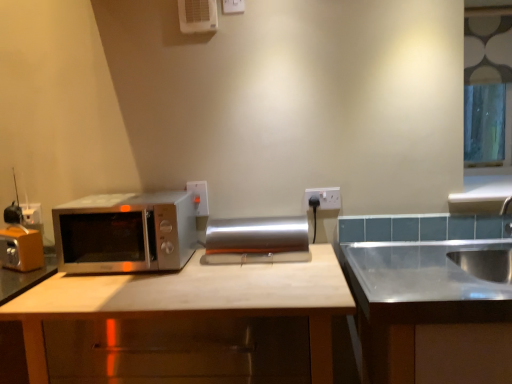
This screenshot has height=384, width=512. Describe the element at coordinates (432, 310) in the screenshot. I see `satin silver sink at right, the second cabinetry viewed from the left` at that location.

This screenshot has height=384, width=512. Find the location of `matte wood cabinet at center, marked as the 1th cabinetry in a left-to-right arrangement`. matte wood cabinet at center, marked as the 1th cabinetry in a left-to-right arrangement is located at coordinates (193, 299).

Locate an element on the screen. This screenshot has width=512, height=384. satin silver microwave at left is located at coordinates (125, 232).

The width and height of the screenshot is (512, 384). What do you see at coordinates (257, 240) in the screenshot?
I see `silver metallic paper towel holder at center` at bounding box center [257, 240].

Identify the location of silver metallic paper towel holder at center. This screenshot has height=384, width=512. (257, 240).

At what (x,y) coordinates should I click in order to perform the action: click on satin silver sink at right, positioned as the first cabinetry in right-to-left order. Please return your answer as a coordinate pair (x, y). Image resolution: width=512 pixels, height=384 pixels. Looking at the image, I should click on click(432, 310).

Which is closer to the camera, (268, 243) or (495, 98)?

Clearly, point (268, 243) is closer to the camera than point (495, 98).

Is silver metallic paper towel holder at center to the left of clear glass window at upper right from the viewer's perspective?

Yes.

Is silver metallic paper towel holder at center bigger than clear glass window at upper right?

No.

Is silver metallic paper towel holder at center next to clear glass window at upper right?

There is a gap between silver metallic paper towel holder at center and clear glass window at upper right.

Which object is more forward, satin silver sink at right, the second cabinetry viewed from the left, or matte wood cabinet at center, which appears as the second cabinetry when viewed from the right?

satin silver sink at right, the second cabinetry viewed from the left, is more forward.

Is satin silver sink at right, the second cabinetry viewed from the left, far away from matte wood cabinet at center, which appears as the second cabinetry when viewed from the right?

satin silver sink at right, the second cabinetry viewed from the left, is actually quite close to matte wood cabinet at center, which appears as the second cabinetry when viewed from the right.

Can you tell me how much satin silver sink at right, positioned as the first cabinetry in right-to-left order, and matte wood cabinet at center, which appears as the second cabinetry when viewed from the right, differ in facing direction?

There is a 0.0101-degree angle between the facing directions of satin silver sink at right, positioned as the first cabinetry in right-to-left order, and matte wood cabinet at center, which appears as the second cabinetry when viewed from the right.

Is point (511, 361) closer or farther from the camera than point (268, 303)?

Clearly, point (511, 361) is closer to the camera than point (268, 303).

Is matte wood cabinet at center, marked as the 1th cabinetry in a left-to-right arrangement, facing towards white plastic air conditioner at upper center?

No, matte wood cabinet at center, marked as the 1th cabinetry in a left-to-right arrangement, is not turned towards white plastic air conditioner at upper center.

Considering the relative positions of matte wood cabinet at center, which appears as the second cabinetry when viewed from the right, and white plastic air conditioner at upper center in the image provided, is matte wood cabinet at center, which appears as the second cabinetry when viewed from the right, to the right of white plastic air conditioner at upper center from the viewer's perspective?

Indeed, matte wood cabinet at center, which appears as the second cabinetry when viewed from the right, is positioned on the right side of white plastic air conditioner at upper center.

From their relative heights in the image, would you say matte wood cabinet at center, marked as the 1th cabinetry in a left-to-right arrangement, is taller or shorter than white plastic air conditioner at upper center?

In the image, matte wood cabinet at center, marked as the 1th cabinetry in a left-to-right arrangement, appears to be taller than white plastic air conditioner at upper center.

From a real-world perspective, count 2nd cabinetrys downward from the white plastic air conditioner at upper center and point to it. Please provide its 2D coordinates.

[(193, 299)]

Is white plastic electric outlet at upper right spatially inside silver metallic paper towel holder at center, or outside of it?

white plastic electric outlet at upper right is not inside silver metallic paper towel holder at center, it's outside.

Which object is wider, white plastic electric outlet at upper right or silver metallic paper towel holder at center?

silver metallic paper towel holder at center.

Can you confirm if white plastic electric outlet at upper right is positioned to the right of silver metallic paper towel holder at center?

Correct, you'll find white plastic electric outlet at upper right to the right of silver metallic paper towel holder at center.

From the image's perspective, which object appears higher, white plastic electric outlet at upper right or silver metallic paper towel holder at center?

white plastic electric outlet at upper right, from the image's perspective.

Can you tell me how much white plastic electric outlet at upper right and clear glass window at upper right differ in facing direction?

There is a 0.293-degree angle between the facing directions of white plastic electric outlet at upper right and clear glass window at upper right.

Is white plastic electric outlet at upper right aimed at clear glass window at upper right?

No, white plastic electric outlet at upper right is not turned towards clear glass window at upper right.

From a real-world perspective, is white plastic electric outlet at upper right over clear glass window at upper right?

No, from a real-world perspective, white plastic electric outlet at upper right is not on top of clear glass window at upper right.

Which is behind, point (309, 190) or point (499, 76)?

The point (499, 76) is farther.

Is satin silver microwave at left positioned far away from white plastic electric outlet at upper right?

satin silver microwave at left is actually quite close to white plastic electric outlet at upper right.

Is satin silver microwave at left located outside white plastic electric outlet at upper right?

Yes, satin silver microwave at left is located beyond the bounds of white plastic electric outlet at upper right.

Visually, is satin silver microwave at left positioned to the left or to the right of white plastic electric outlet at upper right?

From the image, it's evident that satin silver microwave at left is to the left of white plastic electric outlet at upper right.

Which object is wider, satin silver microwave at left or white plastic electric outlet at upper right?

With larger width is satin silver microwave at left.

Does point (82, 223) lie behind point (209, 239)?

No, it is not.

Is satin silver microwave at left facing towards silver metallic paper towel holder at center?

No, satin silver microwave at left is not aimed at silver metallic paper towel holder at center.

Does satin silver microwave at left contain silver metallic paper towel holder at center?

That's incorrect, silver metallic paper towel holder at center is not inside satin silver microwave at left.

Does satin silver microwave at left have a lesser height compared to silver metallic paper towel holder at center?

Incorrect, the height of satin silver microwave at left does not fall short of that of silver metallic paper towel holder at center.

Where is `appliance below the clear glass window at upper right (from the image's perspective)`? This screenshot has width=512, height=384. appliance below the clear glass window at upper right (from the image's perspective) is located at coordinates (257, 240).

This screenshot has height=384, width=512. In order to click on cabinetry above the matte wood cabinet at center, which appears as the second cabinetry when viewed from the right (from the image's perspective) in this screenshot , I will do `click(432, 310)`.

Based on the photo, from the image, which object appears to be nearer to matte wood cabinet at center, marked as the 1th cabinetry in a left-to-right arrangement, silver metallic paper towel holder at center or white plastic electric outlet at upper right?

The object closer to matte wood cabinet at center, marked as the 1th cabinetry in a left-to-right arrangement, is silver metallic paper towel holder at center.

Considering their positions, is satin silver microwave at left positioned closer to clear glass window at upper right than matte wood cabinet at center, which appears as the second cabinetry when viewed from the right?

Among the two, matte wood cabinet at center, which appears as the second cabinetry when viewed from the right, is located nearer to clear glass window at upper right.

Looking at the image, which one is located closer to satin silver sink at right, positioned as the first cabinetry in right-to-left order, matte wood cabinet at center, marked as the 1th cabinetry in a left-to-right arrangement, or white plastic electric outlet at upper right?

matte wood cabinet at center, marked as the 1th cabinetry in a left-to-right arrangement.

Considering their positions, is matte wood cabinet at center, which appears as the second cabinetry when viewed from the right, positioned further to white plastic air conditioner at upper center than satin silver sink at right, the second cabinetry viewed from the left?

satin silver sink at right, the second cabinetry viewed from the left, is further to white plastic air conditioner at upper center.

Looking at the image, which one is located further to white plastic electric outlet at upper right, matte wood cabinet at center, which appears as the second cabinetry when viewed from the right, or clear glass window at upper right?

clear glass window at upper right is further to white plastic electric outlet at upper right.

Estimate the real-world distances between objects in this image. Which object is further from clear glass window at upper right, white plastic electric outlet at upper right or matte wood cabinet at center, marked as the 1th cabinetry in a left-to-right arrangement?

matte wood cabinet at center, marked as the 1th cabinetry in a left-to-right arrangement, is further to clear glass window at upper right.

Considering their positions, is clear glass window at upper right positioned further to white plastic electric outlet at upper right than satin silver sink at right, the second cabinetry viewed from the left?

clear glass window at upper right.

Estimate the real-world distances between objects in this image. Which object is further from white plastic electric outlet at upper right, satin silver microwave at left or satin silver sink at right, positioned as the first cabinetry in right-to-left order?

Among the two, satin silver microwave at left is located further to white plastic electric outlet at upper right.

Identify the location of electric outlet located between matte wood cabinet at center, marked as the 1th cabinetry in a left-to-right arrangement, and clear glass window at upper right in the left-right direction. This screenshot has width=512, height=384. (324, 197).

This screenshot has width=512, height=384. What are the coordinates of `electric outlet located between satin silver sink at right, the second cabinetry viewed from the left, and clear glass window at upper right in the depth direction` in the screenshot? It's located at (324, 197).

Identify the location of appliance located between satin silver microwave at left and satin silver sink at right, positioned as the first cabinetry in right-to-left order, in the left-right direction. The height and width of the screenshot is (384, 512). (257, 240).

Locate an element on the screen. The width and height of the screenshot is (512, 384). appliance between satin silver microwave at left and white plastic electric outlet at upper right from left to right is located at coordinates (257, 240).